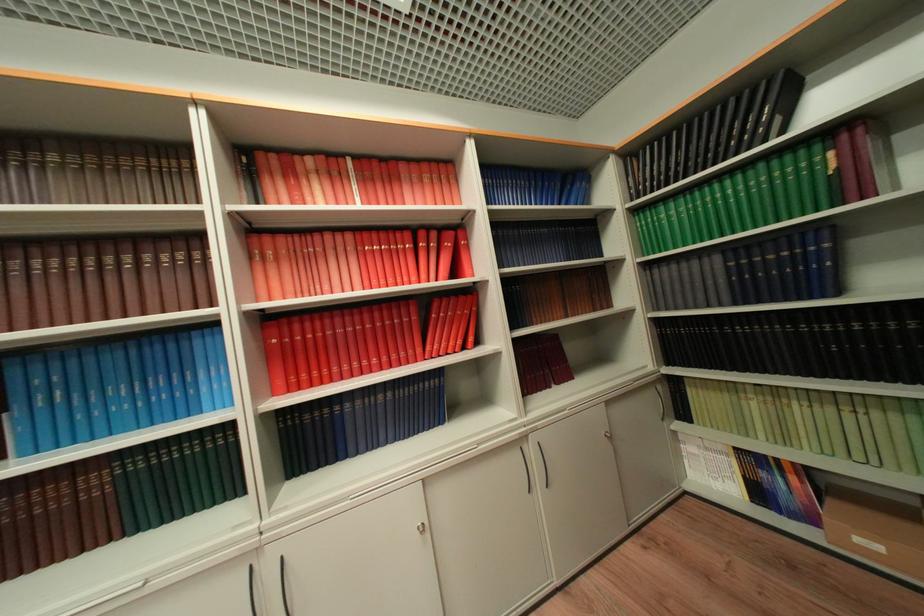
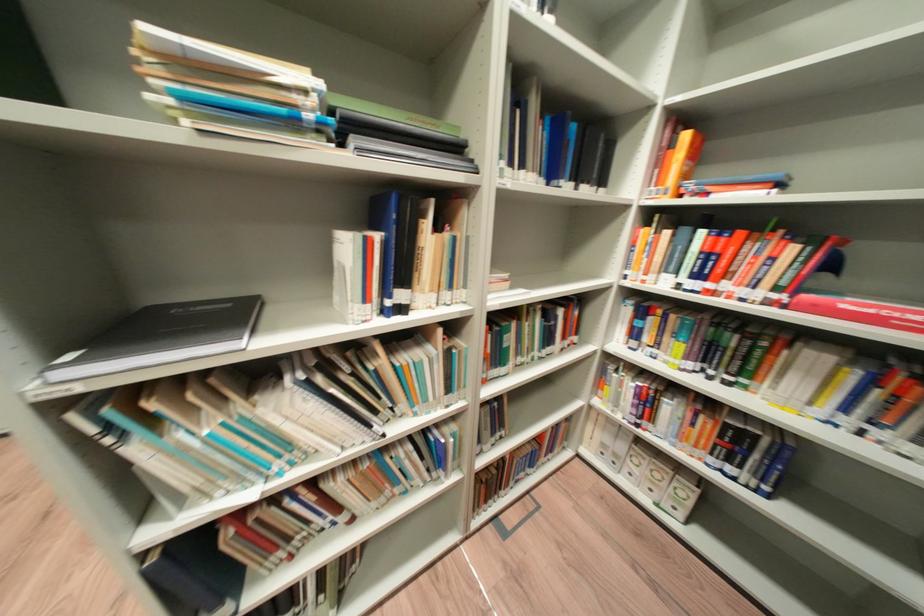
What movement of the cameraman would produce the second image?

The movement direction of the cameraman is right, backward.